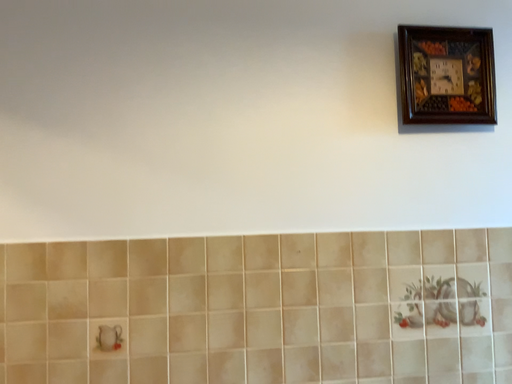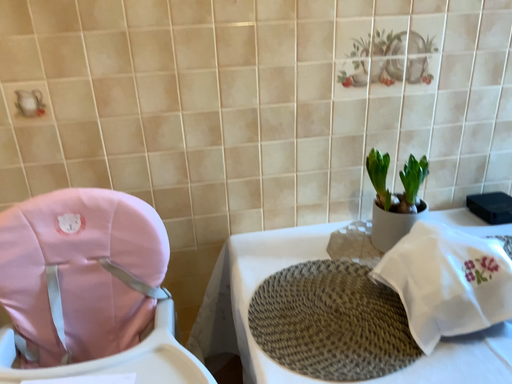
Question: Which way did the camera rotate in the video?

Choices:
 (A) rotated upward
 (B) rotated downward

Answer: (B)